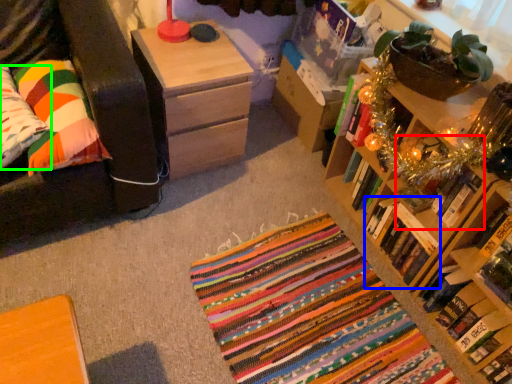
Question: Which object is positioned closest to book (highlighted by a red box)? Select from book (highlighted by a blue box) and pillow (highlighted by a green box).

Choices:
 (A) book
 (B) pillow

Answer: (A)